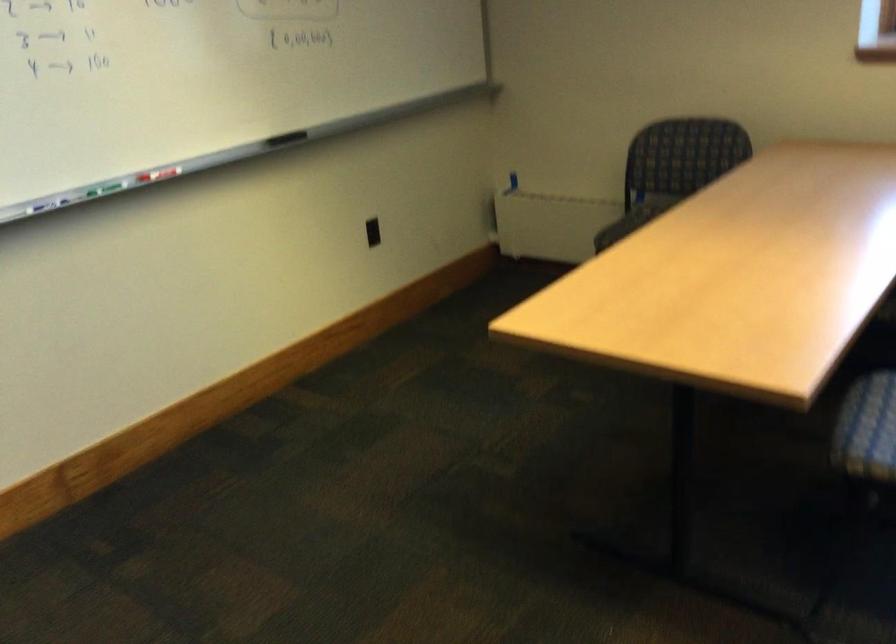
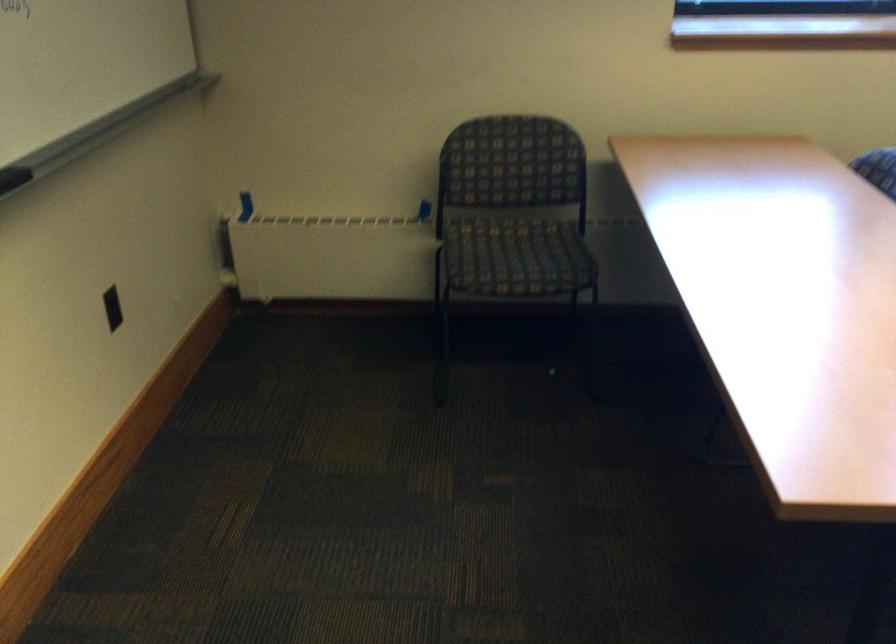
Where in the second image is the point corresponding to pixel 670 202 from the first image?

(488, 220)